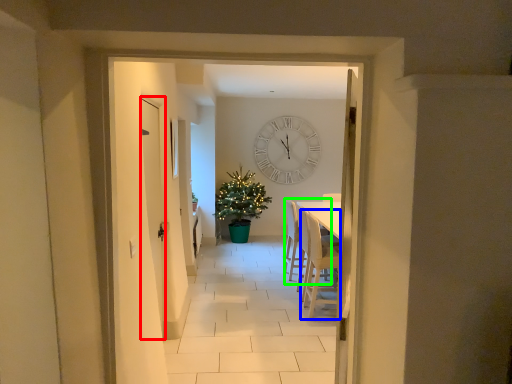
Question: Which object is the closest to the door (highlighted by a red box)? Choose among these: armchair (highlighted by a blue box) or armchair (highlighted by a green box).

Choices:
 (A) armchair
 (B) armchair

Answer: (A)